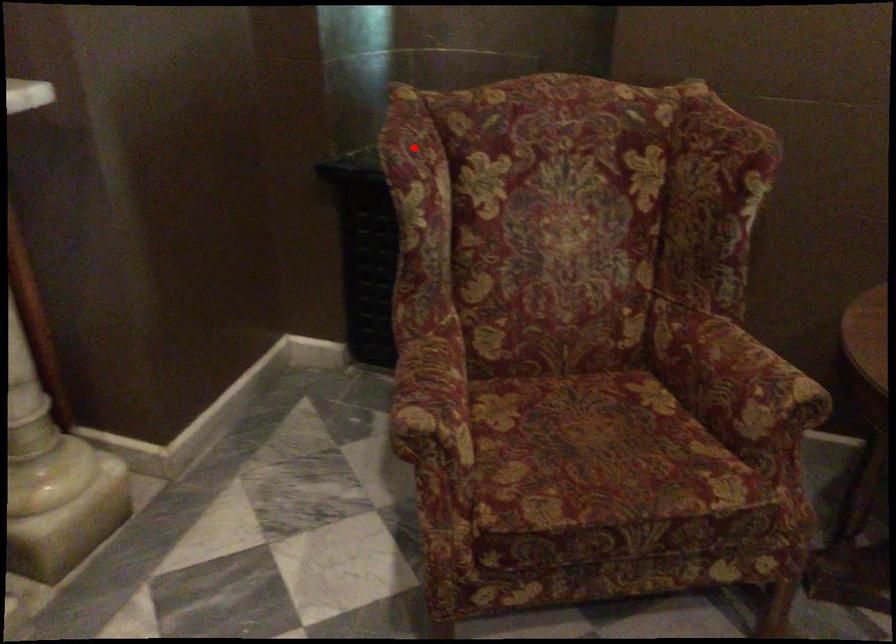
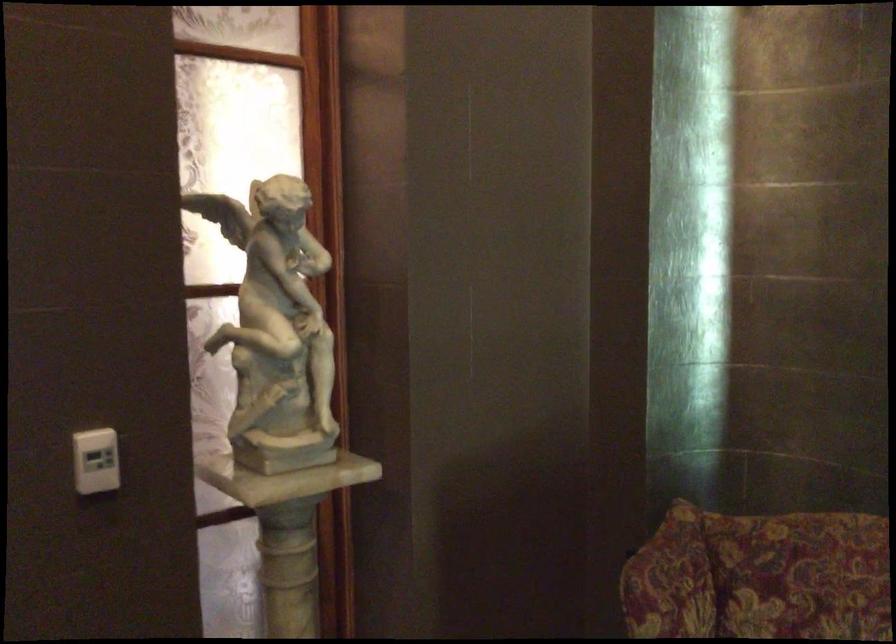
Find the pixel in the second image that matches the highlighted location in the first image.

(670, 581)